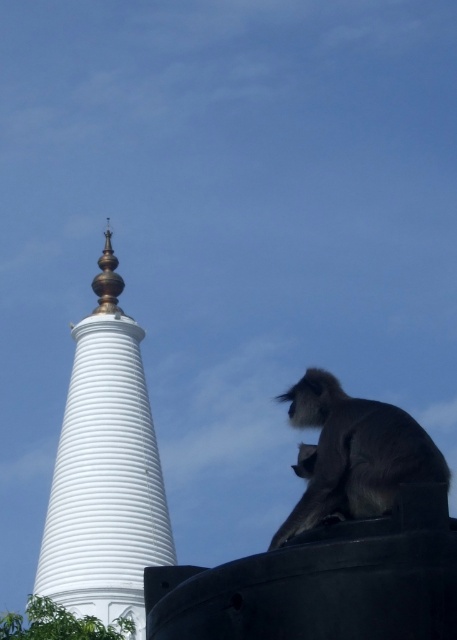
Question: Which point is closer to the camera?

Choices:
 (A) (138, 468)
 (B) (330, 456)

Answer: (B)

Question: Can you confirm if white smooth stupa at left is positioned below gray furry monkey at lower right?

Choices:
 (A) yes
 (B) no

Answer: (A)

Question: Does white smooth stupa at left appear on the right side of gray furry monkey at lower right?

Choices:
 (A) yes
 (B) no

Answer: (B)

Question: Does white smooth stupa at left appear over gray furry monkey at lower right?

Choices:
 (A) no
 (B) yes

Answer: (A)